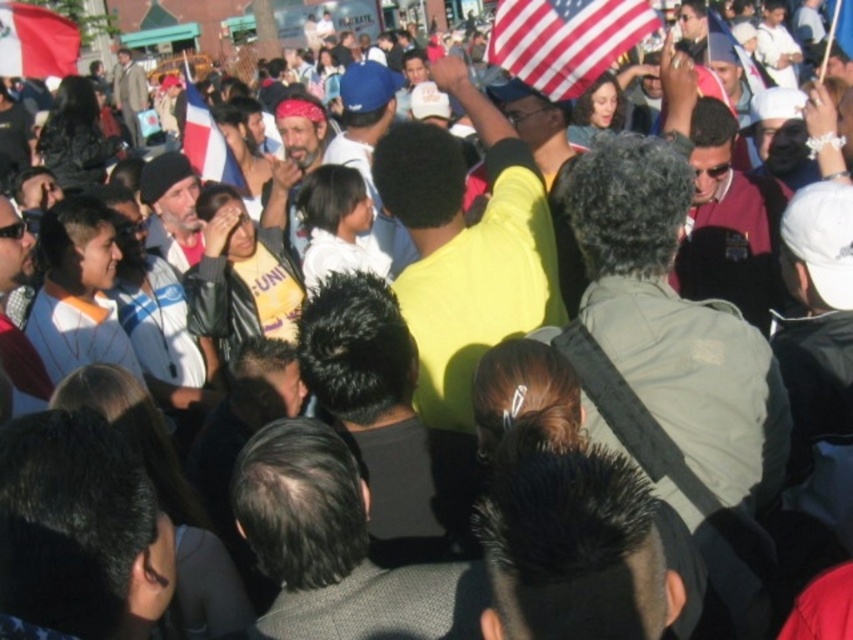
Question: Considering the real-world distances, which object is farthest from the red fabric flag at upper left?

Choices:
 (A) blue fabric flag at upper right
 (B) american flag at upper right

Answer: (A)

Question: Is white fabric flag at center above american flag at upper right?

Choices:
 (A) yes
 (B) no

Answer: (B)

Question: Which point appears farthest from the camera in this image?

Choices:
 (A) (224, 182)
 (B) (56, 22)
 (C) (756, 65)
 (D) (836, 32)

Answer: (B)

Question: Is the position of white fabric flag at center less distant than that of blue fabric flag at upper right?

Choices:
 (A) yes
 (B) no

Answer: (A)

Question: Which of these objects is positioned farthest from the white fabric flag at center?

Choices:
 (A) american flag at upper center
 (B) american flag at upper right
 (C) red fabric flag at upper left

Answer: (B)

Question: Is american flag at upper right to the left of blue fabric flag at upper right from the viewer's perspective?

Choices:
 (A) no
 (B) yes

Answer: (B)